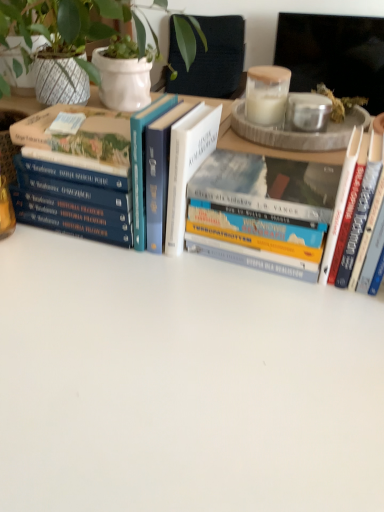
What do you see at coordinates (77, 139) in the screenshot? The image size is (384, 512). I see `hardcover book at left, which is the third book in right-to-left order` at bounding box center [77, 139].

Measure the distance between hardcover book at right, which appears as the 1th book when viewed from the right, and camera.

hardcover book at right, which appears as the 1th book when viewed from the right, and camera are 21.26 inches apart from each other.

The image size is (384, 512). I want to click on hardcover book at center, which ranks as the second book in right-to-left order, so click(268, 186).

From a real-world perspective, is hardcover book at left, acting as the first book starting from the left, physically located above or below hardcover book at right, which appears as the 1th book when viewed from the right?

hardcover book at left, acting as the first book starting from the left, is situated higher than hardcover book at right, which appears as the 1th book when viewed from the right, in the real world.

From the image's perspective, is hardcover book at left, acting as the first book starting from the left, located above hardcover book at right, which is the 3th book from left to right?

Correct, hardcover book at left, acting as the first book starting from the left, appears higher than hardcover book at right, which is the 3th book from left to right, in the image.

Would you say hardcover book at right, which is the 3th book from left to right, is part of hardcover book at left, which is the third book in right-to-left order,'s contents?

No, hardcover book at right, which is the 3th book from left to right, is not inside hardcover book at left, which is the third book in right-to-left order.

In terms of height, does hardcover book at center, which is the 2th book in left-to-right order, look taller or shorter compared to hardcover book at left, which is the third book in right-to-left order?

hardcover book at center, which is the 2th book in left-to-right order, is taller than hardcover book at left, which is the third book in right-to-left order.

Considering their positions, is hardcover book at center, which ranks as the second book in right-to-left order, located in front of or behind hardcover book at left, acting as the first book starting from the left?

hardcover book at center, which ranks as the second book in right-to-left order, is positioned closer to the viewer than hardcover book at left, acting as the first book starting from the left.

Looking at this image, is hardcover book at left, acting as the first book starting from the left, surrounded by hardcover book at center, which is the 2th book in left-to-right order?

No, hardcover book at left, acting as the first book starting from the left, is not surrounded by hardcover book at center, which is the 2th book in left-to-right order.

From the image's perspective, is hardcover book at center, which ranks as the second book in right-to-left order, beneath hardcover book at left, which is the third book in right-to-left order?

Yes, from the image's perspective, hardcover book at center, which ranks as the second book in right-to-left order, is below hardcover book at left, which is the third book in right-to-left order.

From a real-world perspective, is hardcover book at center, which is the 2th book in left-to-right order, on hardcover book at right, which appears as the 1th book when viewed from the right?

No, from a real-world perspective, hardcover book at center, which is the 2th book in left-to-right order, is not over hardcover book at right, which appears as the 1th book when viewed from the right

From the image's perspective, is hardcover book at center, which ranks as the second book in right-to-left order, beneath hardcover book at right, which is the 3th book from left to right?

Actually, hardcover book at center, which ranks as the second book in right-to-left order, appears above hardcover book at right, which is the 3th book from left to right, in the image.

In the scene shown: Which object is further away from the camera, hardcover book at right, which appears as the 1th book when viewed from the right, or hardcover book at left, which is the third book in right-to-left order?

hardcover book at left, which is the third book in right-to-left order, is more distant.

From a real-world perspective, between hardcover book at right, which appears as the 1th book when viewed from the right, and hardcover book at left, acting as the first book starting from the left, who is vertically higher?

hardcover book at left, acting as the first book starting from the left.

Who is bigger, hardcover book at right, which is the 3th book from left to right, or hardcover book at left, acting as the first book starting from the left?

Bigger between the two is hardcover book at right, which is the 3th book from left to right.

Which object is more forward, hardcover book at right, which appears as the 1th book when viewed from the right, or hardcover book at center, which is the 2th book in left-to-right order?

hardcover book at right, which appears as the 1th book when viewed from the right, is closer to the camera.

Can you tell me how much hardcover book at right, which appears as the 1th book when viewed from the right, and hardcover book at center, which ranks as the second book in right-to-left order, differ in facing direction?

The facing directions of hardcover book at right, which appears as the 1th book when viewed from the right, and hardcover book at center, which ranks as the second book in right-to-left order, are 0.00101 degrees apart.

Locate an element on the screen. Image resolution: width=384 pixels, height=512 pixels. book on the right of hardcover book at center, which ranks as the second book in right-to-left order is located at coordinates (362, 209).

Is hardcover book at right, which is the 3th book from left to right, not close to hardcover book at center, which is the 2th book in left-to-right order?

hardcover book at right, which is the 3th book from left to right, is near hardcover book at center, which is the 2th book in left-to-right order, not far away.

From a real-world perspective, relative to hardcover book at center, which ranks as the second book in right-to-left order, is hardcover book at left, which is the third book in right-to-left order, vertically above or below?

Clearly, from a real-world perspective, hardcover book at left, which is the third book in right-to-left order, is above hardcover book at center, which ranks as the second book in right-to-left order.

From the image's perspective, is hardcover book at left, acting as the first book starting from the left, above or below hardcover book at center, which is the 2th book in left-to-right order?

hardcover book at left, acting as the first book starting from the left, is above hardcover book at center, which is the 2th book in left-to-right order.

Which is in front, hardcover book at left, acting as the first book starting from the left, or hardcover book at center, which ranks as the second book in right-to-left order?

hardcover book at center, which ranks as the second book in right-to-left order, is closer to the camera.

Looking at this image, based on their sizes in the image, would you say hardcover book at left, acting as the first book starting from the left, is bigger or smaller than hardcover book at center, which ranks as the second book in right-to-left order?

Clearly, hardcover book at left, acting as the first book starting from the left, is smaller in size than hardcover book at center, which ranks as the second book in right-to-left order.

I want to click on the 2nd book to the right of the hardcover book at left, which is the third book in right-to-left order, starting your count from the anchor, so click(362, 209).

Where is `book that is the 2nd one above the hardcover book at center, which ranks as the second book in right-to-left order (from a real-world perspective)`? book that is the 2nd one above the hardcover book at center, which ranks as the second book in right-to-left order (from a real-world perspective) is located at coordinates (77, 139).

Which object lies nearer to the anchor point hardcover book at right, which is the 3th book from left to right, hardcover book at center, which ranks as the second book in right-to-left order, or hardcover book at left, which is the third book in right-to-left order?

hardcover book at center, which ranks as the second book in right-to-left order.

When comparing their distances from hardcover book at right, which appears as the 1th book when viewed from the right, does hardcover book at left, which is the third book in right-to-left order, or hardcover book at center, which ranks as the second book in right-to-left order, seem closer?

hardcover book at center, which ranks as the second book in right-to-left order.

Considering their positions, is hardcover book at center, which is the 2th book in left-to-right order, positioned closer to hardcover book at left, acting as the first book starting from the left, than hardcover book at right, which is the 3th book from left to right?

Among the two, hardcover book at center, which is the 2th book in left-to-right order, is located nearer to hardcover book at left, acting as the first book starting from the left.

Which object lies further to the anchor point hardcover book at center, which is the 2th book in left-to-right order, hardcover book at left, which is the third book in right-to-left order, or hardcover book at right, which is the 3th book from left to right?

hardcover book at left, which is the third book in right-to-left order, lies further to hardcover book at center, which is the 2th book in left-to-right order, than the other object.

When comparing their distances from hardcover book at left, which is the third book in right-to-left order, does hardcover book at right, which appears as the 1th book when viewed from the right, or hardcover book at center, which is the 2th book in left-to-right order, seem closer?

hardcover book at center, which is the 2th book in left-to-right order, is positioned closer to the anchor hardcover book at left, which is the third book in right-to-left order.

Based on their spatial positions, is hardcover book at right, which is the 3th book from left to right, or hardcover book at left, acting as the first book starting from the left, closer to hardcover book at center, which is the 2th book in left-to-right order?

Based on the image, hardcover book at right, which is the 3th book from left to right, appears to be nearer to hardcover book at center, which is the 2th book in left-to-right order.

Where is `book between hardcover book at left, which is the third book in right-to-left order, and hardcover book at right, which appears as the 1th book when viewed from the right, from left to right`? Image resolution: width=384 pixels, height=512 pixels. book between hardcover book at left, which is the third book in right-to-left order, and hardcover book at right, which appears as the 1th book when viewed from the right, from left to right is located at coordinates (268, 186).